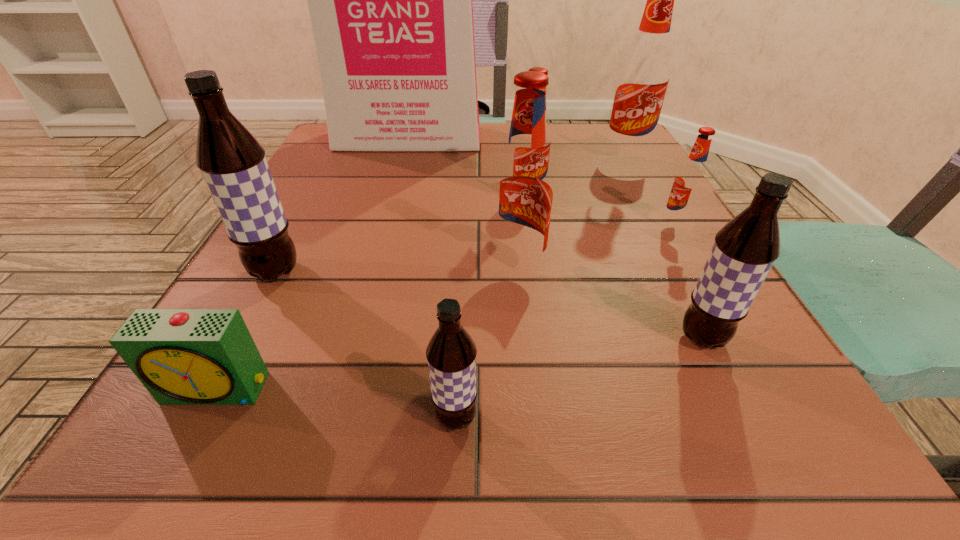
Where is `the seventh nearest object`? The image size is (960, 540). the seventh nearest object is located at coordinates (539, 69).

Image resolution: width=960 pixels, height=540 pixels. In order to click on the smallest red root beer in this screenshot , I will do (689, 183).

This screenshot has height=540, width=960. What are the coordinates of `the second nearest red root beer` in the screenshot? It's located at (689, 183).

You are a GUI agent. You are given a task and a screenshot of the screen. Output one action in this format:
    pyautogui.click(x=<x>, y=<y>)
    Task: Click on the second brown root beer from right to left
    
    Given the screenshot: What is the action you would take?
    (451, 353)

The width and height of the screenshot is (960, 540). What are the coordinates of `the nearest root beer` in the screenshot? It's located at (451, 353).

Find the location of a particular element. This screenshot has height=540, width=960. the shortest object is located at coordinates (182, 356).

The height and width of the screenshot is (540, 960). Find the location of `green alarm clock`. green alarm clock is located at coordinates (182, 356).

Find the location of `free region located 0.140m on the front-facing side of the pink shopping bag`. free region located 0.140m on the front-facing side of the pink shopping bag is located at coordinates (396, 183).

Identify the location of vacant area located on the left of the biggest red root beer. Image resolution: width=960 pixels, height=540 pixels. (485, 157).

Locate an element on the screen. vacant area located on the back of the nearest red root beer is located at coordinates (513, 219).